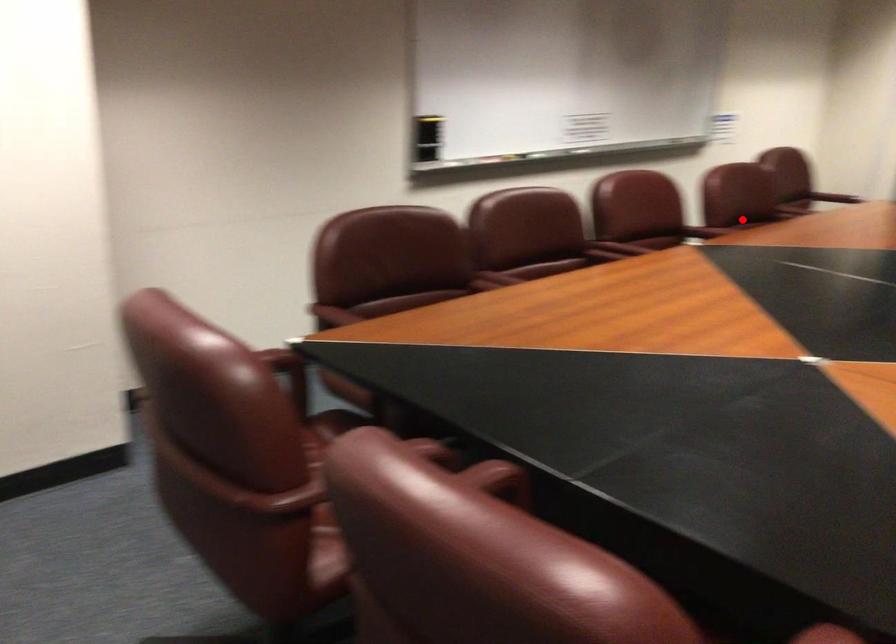
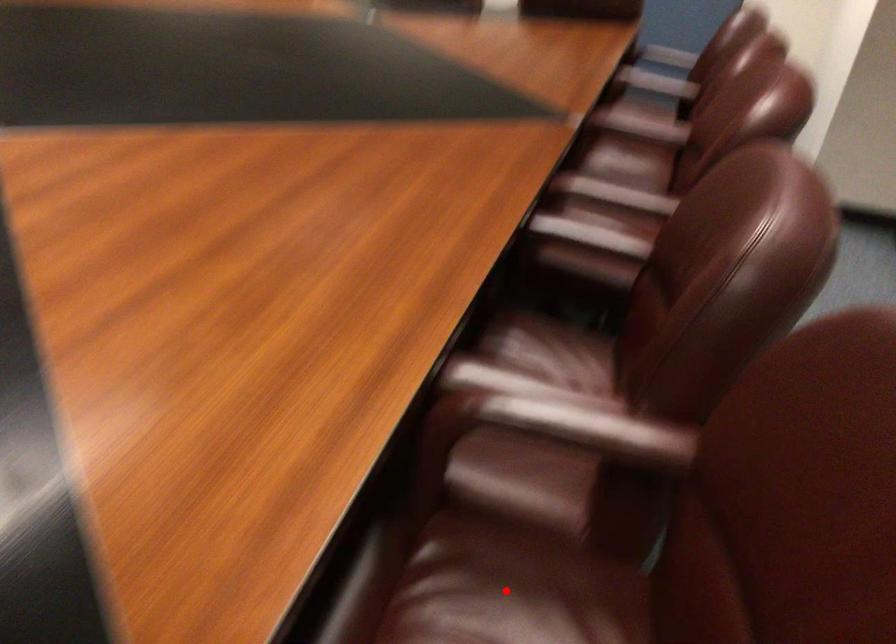
I am providing you with two images of the same scene from different viewpoints. A red point is marked on the first image and another point is marked on the second image. Does the point marked in image1 correspond to the same location as the one in image2?

No